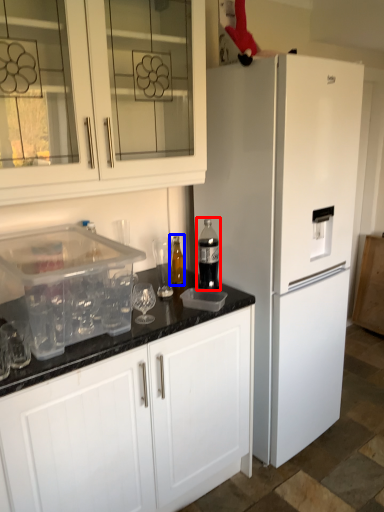
Question: Which object appears closest to the camera in this image, bottle (highlighted by a red box) or bottle (highlighted by a blue box)?

Choices:
 (A) bottle
 (B) bottle

Answer: (A)